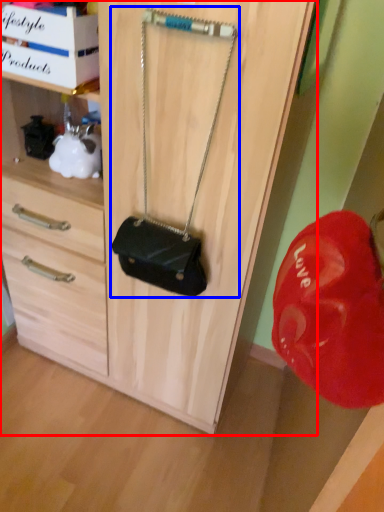
Question: Which of the following is the closest to the observer, cabinetry (highlighted by a red box) or handbag (highlighted by a blue box)?

Choices:
 (A) cabinetry
 (B) handbag

Answer: (B)